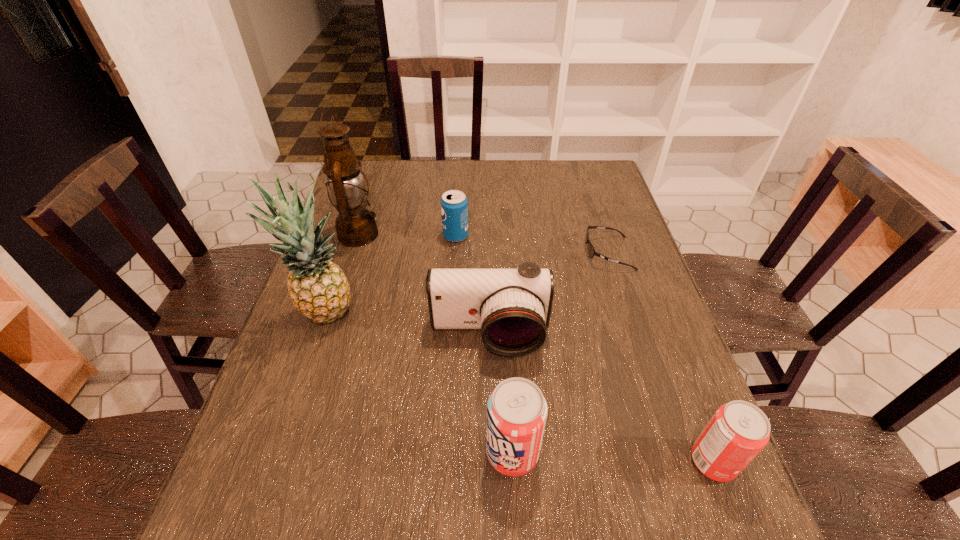
Please point a spot to add another soda can on the left. Please provide its 2D coordinates. Your answer should be formatted as a tuple, i.e. [(x, y)], where the tuple contains the x and y coordinates of a point satisfying the conditions above.

[(318, 445)]